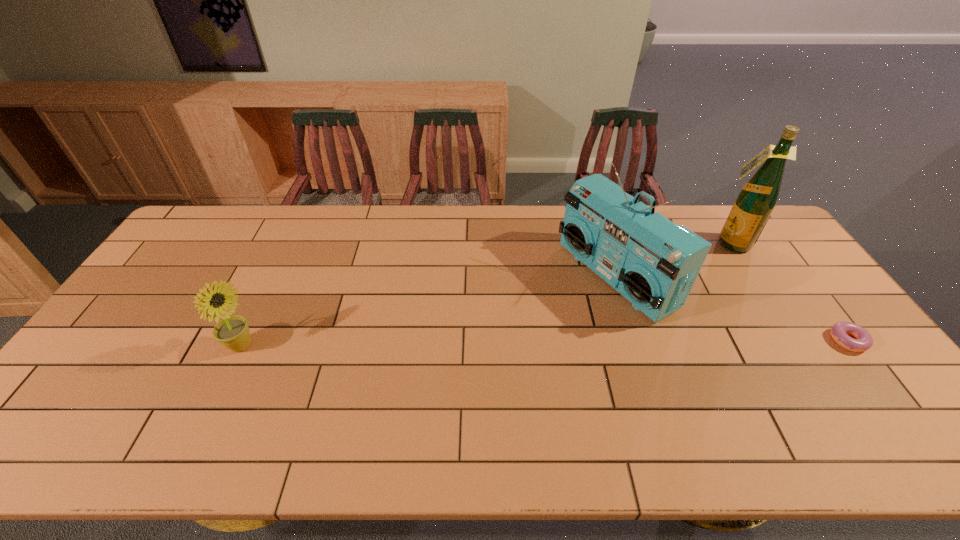
Identify the location of blank region between the leftmost object and the third object from left to right. (485, 294).

You are a GUI agent. You are given a task and a screenshot of the screen. Output one action in this format:
    pyautogui.click(x=<x>, y=<y>)
    Task: Click on the vacant area that lies between the radio receiver and the doughnut
    
    Given the screenshot: What is the action you would take?
    pyautogui.click(x=732, y=309)

The image size is (960, 540). Find the location of `unoccupied position between the sunflower and the liquor`. unoccupied position between the sunflower and the liquor is located at coordinates (485, 294).

At what (x,y) coordinates should I click in order to perform the action: click on free space between the third object from right to left and the second shortest object. Please return your answer as a coordinate pair (x, y). Looking at the image, I should click on (428, 312).

At what (x,y) coordinates should I click in order to perform the action: click on free spot between the rightmost object and the radio receiver. Please return your answer as a coordinate pair (x, y). This screenshot has height=540, width=960. Looking at the image, I should click on (732, 309).

Find the location of `unoccupied area between the second object from left to right and the leftmost object`. unoccupied area between the second object from left to right and the leftmost object is located at coordinates pyautogui.click(x=428, y=312).

Locate which object is the third closest to the rightmost object. Please provide its 2D coordinates. Your answer should be formatted as a tuple, i.e. [(x, y)], where the tuple contains the x and y coordinates of a point satisfying the conditions above.

[(233, 332)]

The height and width of the screenshot is (540, 960). I want to click on object that is the second nearest to the third object from right to left, so click(x=863, y=340).

Find the location of a particular element. The width and height of the screenshot is (960, 540). free space in the image that satisfies the following two spatial constraints: 1. on the back side of the second tallest object; 2. on the left side of the liquor is located at coordinates (604, 242).